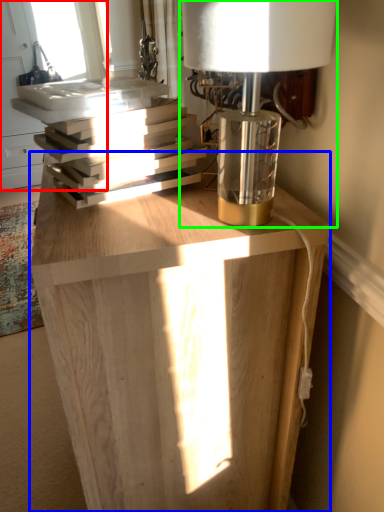
Question: Which object is the farthest from window (highlighted by a red box)? Choose among these: table (highlighted by a blue box) or lamp (highlighted by a green box).

Choices:
 (A) table
 (B) lamp

Answer: (A)